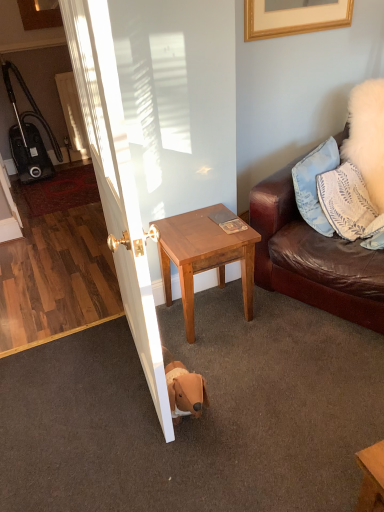
Where is `vacant area that is situated to the right of white glossy door at center`? The image size is (384, 512). vacant area that is situated to the right of white glossy door at center is located at coordinates (266, 377).